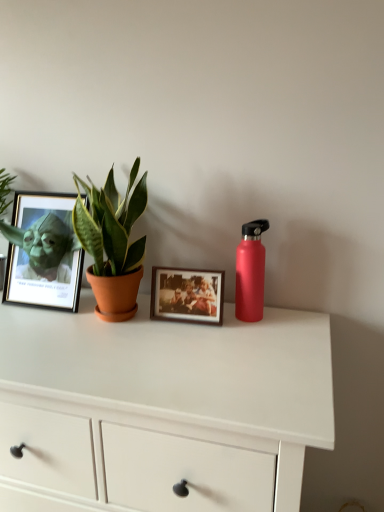
Where is `space that is in front of green matte plant at left`? Image resolution: width=384 pixels, height=512 pixels. space that is in front of green matte plant at left is located at coordinates (102, 349).